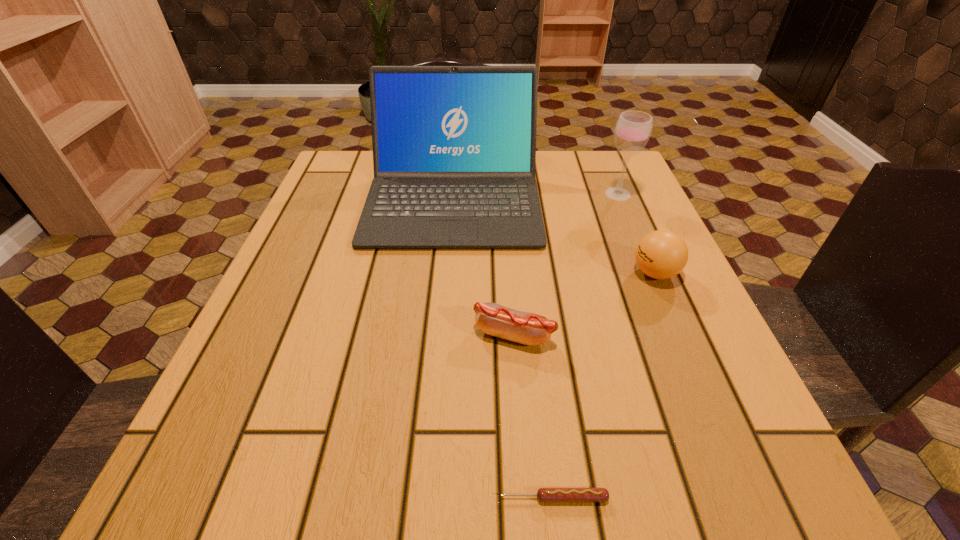
The image size is (960, 540). Identify the location of laptop computer. (454, 147).

The height and width of the screenshot is (540, 960). What are the coordinates of `wineglass` in the screenshot? It's located at pyautogui.click(x=633, y=129).

The width and height of the screenshot is (960, 540). Find the location of `the third shortest object`. the third shortest object is located at coordinates (662, 254).

Image resolution: width=960 pixels, height=540 pixels. Find the location of `the third farthest object`. the third farthest object is located at coordinates (662, 254).

In order to click on the fourth tallest object in this screenshot , I will do `click(532, 329)`.

You are a GUI agent. You are given a task and a screenshot of the screen. Output one action in this format:
    pyautogui.click(x=<x>, y=<y>)
    Task: Click on the taller sausage
    The width and height of the screenshot is (960, 540).
    Given the screenshot: What is the action you would take?
    pyautogui.click(x=532, y=329)

Find the location of a particular element. The height and width of the screenshot is (540, 960). the nearer sausage is located at coordinates (545, 495).

Identify the location of the shortest object. The image size is (960, 540). (545, 495).

The image size is (960, 540). What are the coordinates of `free space located on the screen of the laptop computer` in the screenshot? It's located at (444, 323).

Identify the location of free region located on the front of the fourth shortest object. (665, 308).